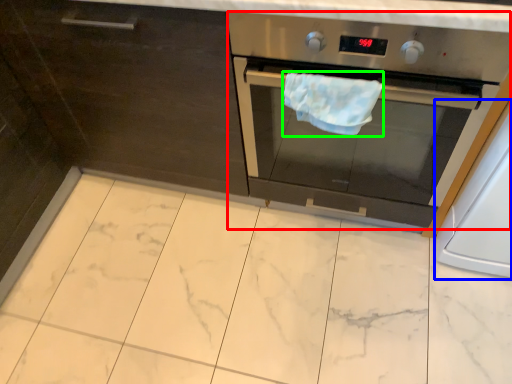
Question: Which object is the farthest from home appliance (highlighted by a red box)? Choose among these: appliance (highlighted by a blue box) or hand towel (highlighted by a green box).

Choices:
 (A) appliance
 (B) hand towel

Answer: (A)